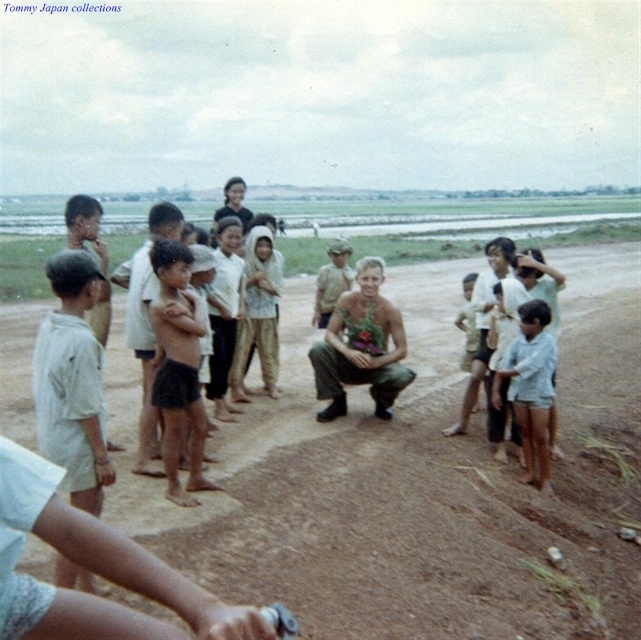
Is brown dirt field at center taller than light brown fabric headscarf at center?

Yes.

Locate an element on the screen. brown dirt field at center is located at coordinates (426, 486).

The height and width of the screenshot is (640, 641). Describe the element at coordinates (426, 486) in the screenshot. I see `brown dirt field at center` at that location.

Where is `brown dirt field at center`? The image size is (641, 640). brown dirt field at center is located at coordinates (426, 486).

How much distance is there between light brown fabric headscarf at center and dark brown skin at center?

light brown fabric headscarf at center is 1.09 meters away from dark brown skin at center.

Is point (274, 364) positioned in front of point (222, 211)?

Yes.

Describe the element at coordinates (256, 314) in the screenshot. This screenshot has height=640, width=641. I see `light brown fabric headscarf at center` at that location.

I want to click on light brown fabric headscarf at center, so click(256, 314).

From the picture: Is white cotton shirt at left wider than light brown fabric headscarf at center?

In fact, white cotton shirt at left might be narrower than light brown fabric headscarf at center.

Measure the distance between point (58, 253) and camera.

The distance of point (58, 253) from camera is 3.51 meters.

You are a GUI agent. You are given a task and a screenshot of the screen. Output one action in this format:
    pyautogui.click(x=<x>, y=<y>)
    Task: Click on the white cotton shirt at left
    This screenshot has width=641, height=640.
    Given the screenshot: What is the action you would take?
    pyautogui.click(x=71, y=381)

You are a GUI agent. You are given a task and a screenshot of the screen. Output one action in this format:
    pyautogui.click(x=<x>, y=<y>)
    Task: Click on the white cotton shirt at left
    
    Given the screenshot: What is the action you would take?
    pyautogui.click(x=71, y=381)